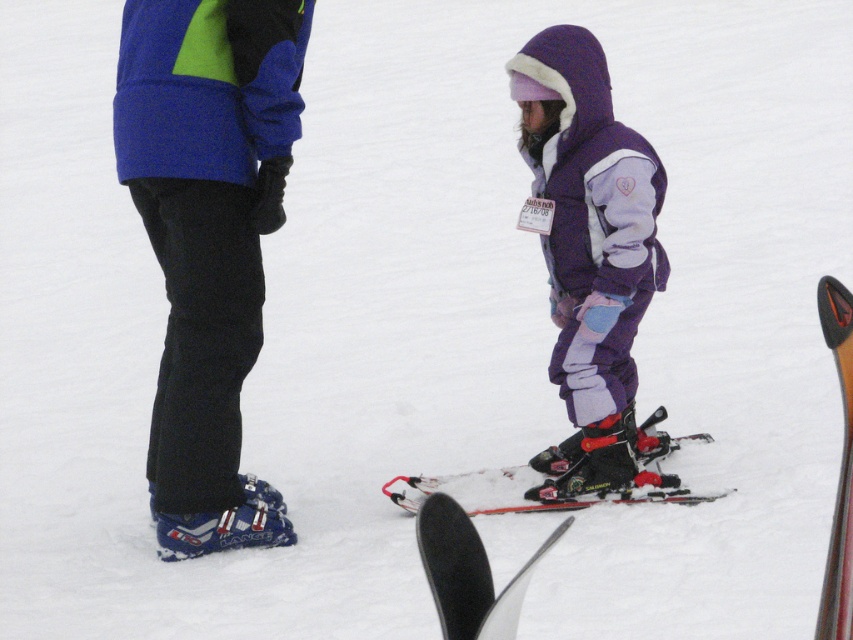
Question: Which object appears closest to the camera in this image?

Choices:
 (A) purple fleece jacket at center
 (B) blue matte ski boots at lower left
 (C) red matte skis at center

Answer: (B)

Question: Among these objects, which one is nearest to the camera?

Choices:
 (A) shiny black ski at lower right
 (B) red matte skis at center
 (C) black matte ski at lower center

Answer: (C)

Question: Does purple fleece jacket at center have a greater width compared to black matte ski at lower center?

Choices:
 (A) no
 (B) yes

Answer: (B)

Question: Can you confirm if blue matte ski boots at lower left is positioned below shiny black ski at lower right?

Choices:
 (A) yes
 (B) no

Answer: (B)

Question: Which object is positioned closest to the blue matte ski boots at lower left?

Choices:
 (A) red matte skis at center
 (B) purple fleece jacket at center

Answer: (A)

Question: Is red matte skis at center positioned behind shiny black ski at lower right?

Choices:
 (A) yes
 (B) no

Answer: (A)